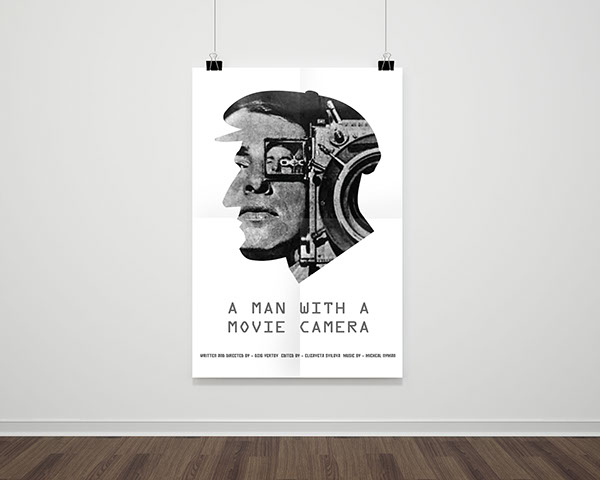
Identify the location of wall. click(538, 322).